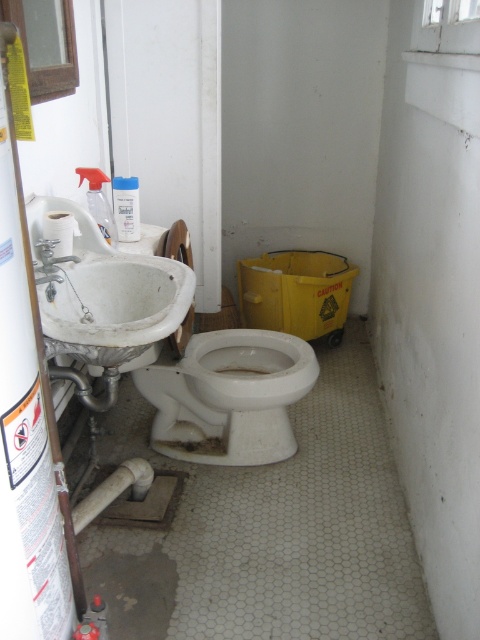
Question: Is white matte toilet at center to the right of white matte sink at left from the viewer's perspective?

Choices:
 (A) no
 (B) yes

Answer: (B)

Question: Which point is closer to the camera?

Choices:
 (A) white matte toilet at center
 (B) white matte sink at left

Answer: (B)

Question: Which point appears closest to the camera in this image?

Choices:
 (A) (37, 202)
 (B) (240, 330)

Answer: (A)

Question: Can you confirm if white matte toilet at center is positioned to the left of white matte sink at left?

Choices:
 (A) no
 (B) yes

Answer: (A)

Question: Does white matte toilet at center appear over white matte sink at left?

Choices:
 (A) no
 (B) yes

Answer: (A)